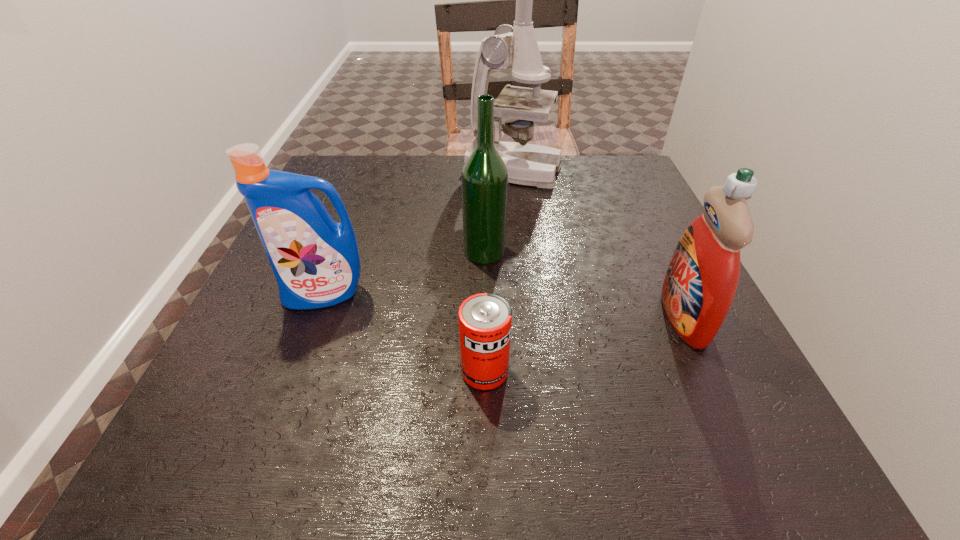
Locate an element on the screen. vacant area situated 0.290m on the front surface of the rightmost object is located at coordinates (495, 316).

The height and width of the screenshot is (540, 960). I want to click on free location located on the front surface of the rightmost object, so click(x=593, y=316).

The width and height of the screenshot is (960, 540). I want to click on vacant space situated on the back of the shortest object, so click(483, 212).

Image resolution: width=960 pixels, height=540 pixels. I want to click on object present at the far edge, so click(515, 47).

Identify the location of object positioned at the left edge. This screenshot has width=960, height=540. (316, 262).

The width and height of the screenshot is (960, 540). I want to click on object at the right edge, so click(699, 287).

The height and width of the screenshot is (540, 960). What are the coordinates of `vacant space at the far edge` in the screenshot? It's located at (450, 166).

Where is `free space at the near edge`? This screenshot has height=540, width=960. free space at the near edge is located at coordinates (635, 464).

The height and width of the screenshot is (540, 960). In order to click on free space at the left edge of the desktop in this screenshot , I will do `click(222, 354)`.

The height and width of the screenshot is (540, 960). In the image, there is a desktop. What are the coordinates of `vacant area at the right edge` in the screenshot? It's located at (720, 353).